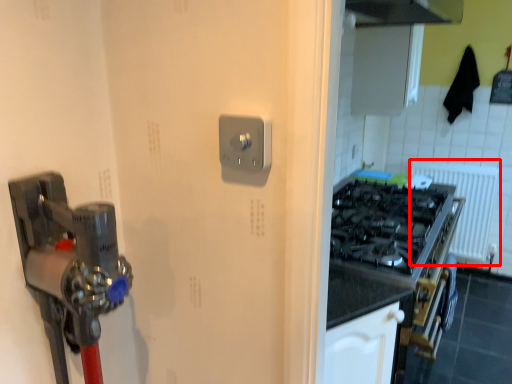
Question: From the image's perspective, where is radiator (annotated by the red box) located relative to light switch?

Choices:
 (A) below
 (B) above

Answer: (A)